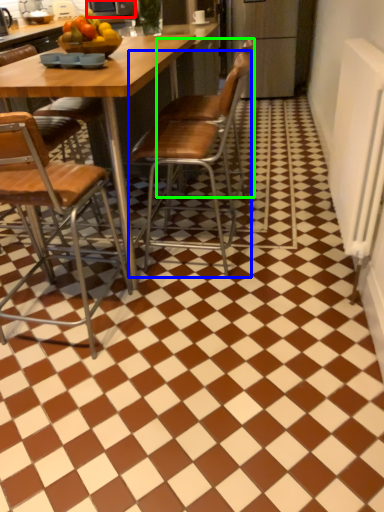
Question: Which object is positioned farthest from appliance (highlighted by a red box)? Select from chair (highlighted by a blue box) and chair (highlighted by a green box).

Choices:
 (A) chair
 (B) chair

Answer: (B)